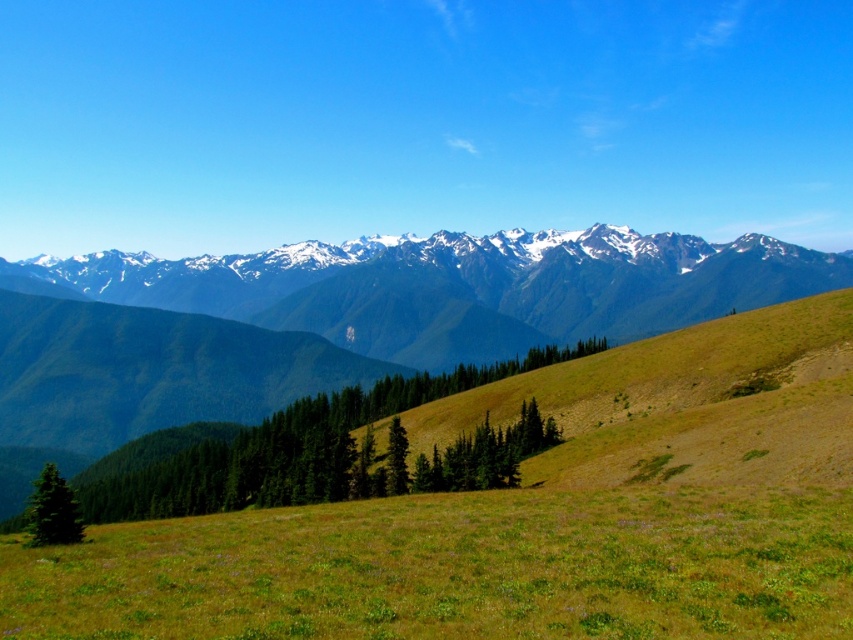
Between green matte tree at lower left and green textured tree at center, which one is positioned higher?

Positioned higher is green textured tree at center.

Between point (74, 518) and point (397, 424), which one is positioned behind?

The point (397, 424) is behind.

In order to click on green matte tree at lower left in this screenshot , I will do [53, 509].

Does green grassy field at lower center appear on the left side of green matte tree at lower left?

No, green grassy field at lower center is not to the left of green matte tree at lower left.

I want to click on green grassy field at lower center, so click(x=454, y=568).

What do you see at coordinates (454, 568) in the screenshot?
I see `green grassy field at lower center` at bounding box center [454, 568].

You are a GUI agent. You are given a task and a screenshot of the screen. Output one action in this format:
    pyautogui.click(x=<x>, y=<y>)
    Task: Click on the green grassy field at lower center
    The width and height of the screenshot is (853, 640).
    Given the screenshot: What is the action you would take?
    pyautogui.click(x=454, y=568)

What do you see at coordinates (281, 449) in the screenshot? The width and height of the screenshot is (853, 640). I see `green textured trees at center` at bounding box center [281, 449].

Which is in front, point (340, 449) or point (49, 529)?

Point (49, 529) is more forward.

Is point (199, 497) in front of point (44, 481)?

That is False.

This screenshot has width=853, height=640. Identify the location of green textured trees at center. (281, 449).